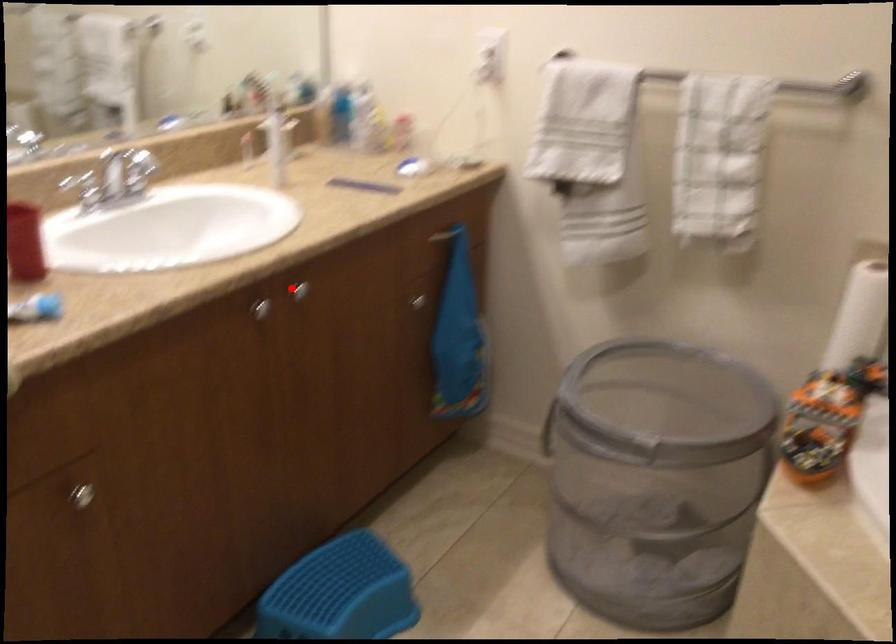
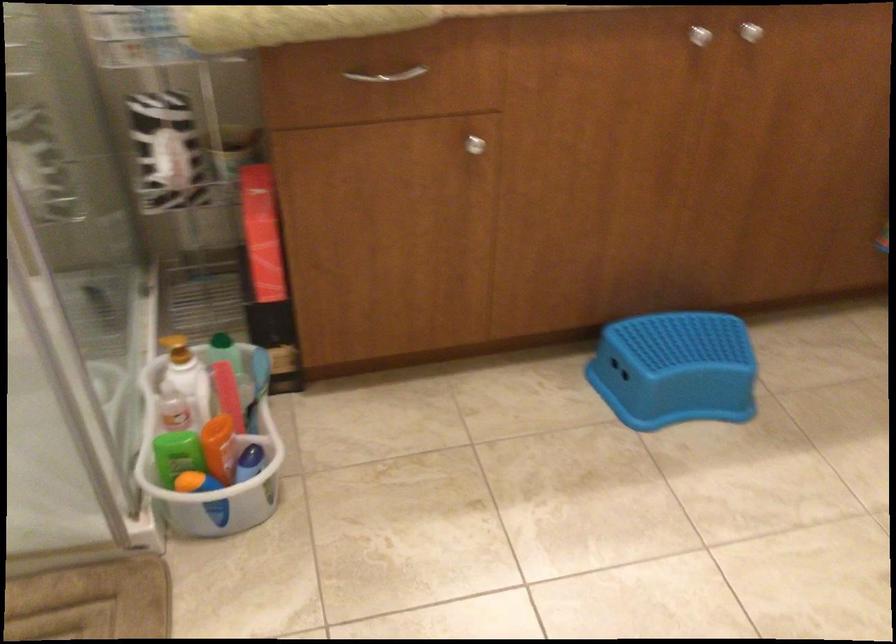
Where in the second image is the point corresponding to the highlighted location from the first image?

(751, 32)